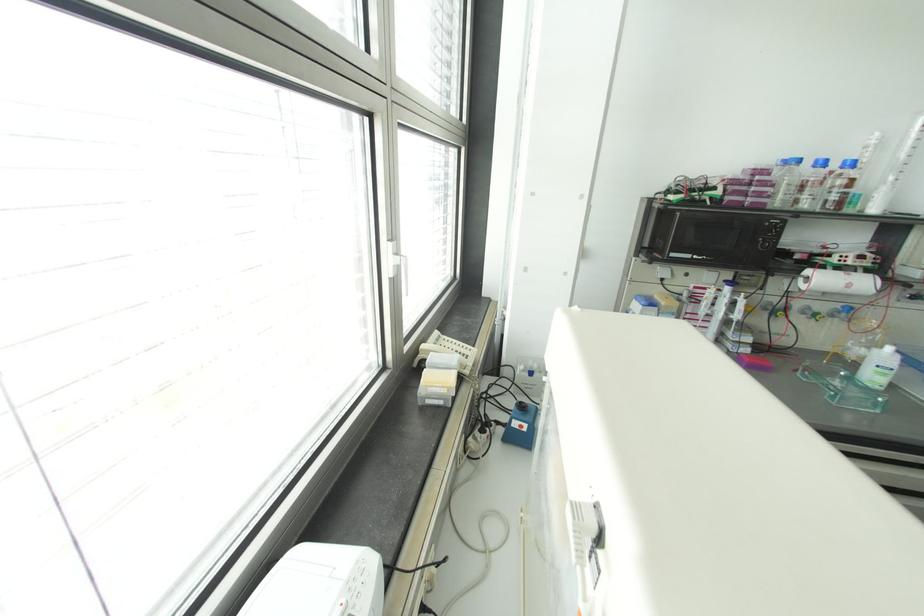
What do you see at coordinates (767, 243) in the screenshot?
I see `the microwave dial` at bounding box center [767, 243].